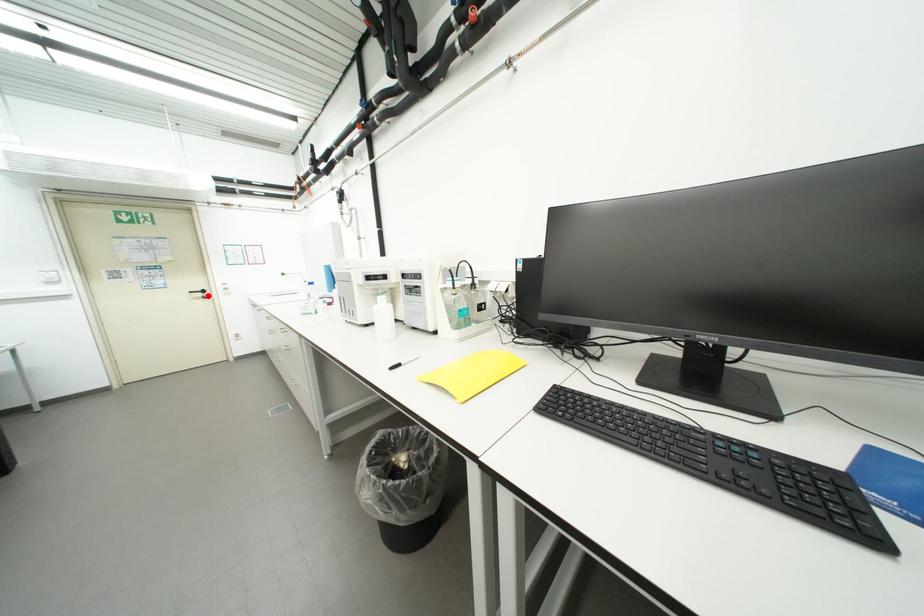
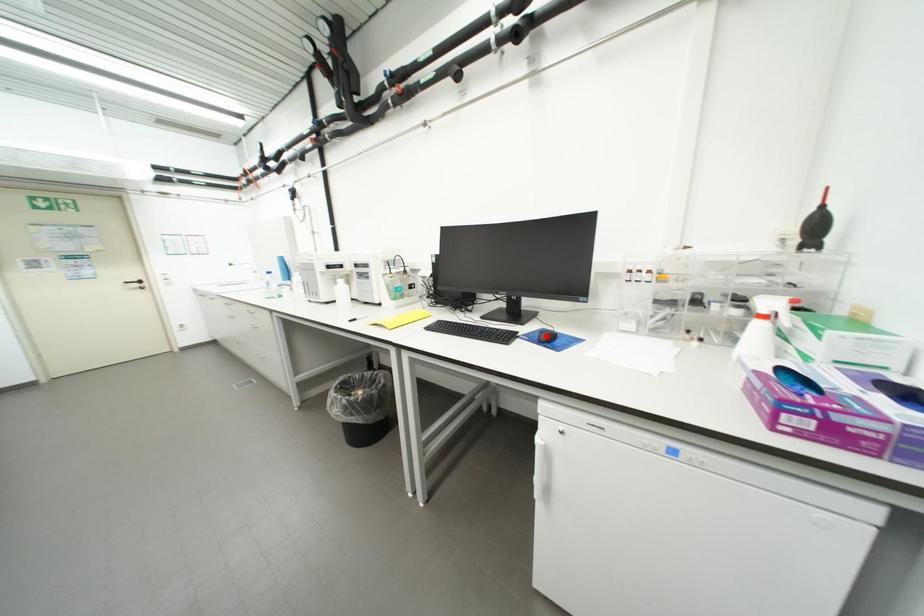
I am providing you with two images of the same scene from different viewpoints. A red point is marked on the first image and another point is marked on the second image. Are the points marked in image1 and image2 representing the same 3D position?

No